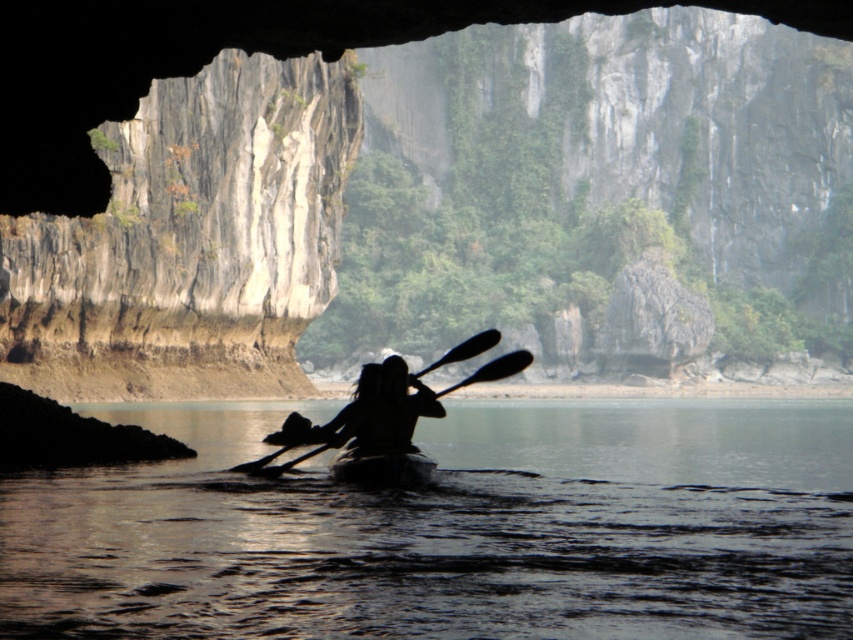
Based on the photo, can you confirm if transparent water at center is taller than black matte paddle at center?

In fact, transparent water at center may be shorter than black matte paddle at center.

Is point (62, 548) positioned behind point (310, 451)?

That is False.

Locate an element on the screen. This screenshot has height=640, width=853. transparent water at center is located at coordinates (451, 529).

Who is more forward, (x=54, y=624) or (x=396, y=406)?

Point (x=54, y=624)

Between transparent water at center and silhouette wood paddle at center, which one has less height?

transparent water at center

Is point (126, 513) behind point (424, 406)?

No, (126, 513) is in front of (424, 406).

Where is `transparent water at center`? The height and width of the screenshot is (640, 853). transparent water at center is located at coordinates (451, 529).

Is point (383, 467) positioned after point (250, 468)?

That is False.

Locate an element on the screen. The image size is (853, 640). smooth dark gray canoe at center is located at coordinates (383, 467).

Find the location of a particular element. This screenshot has height=640, width=853. smooth dark gray canoe at center is located at coordinates (383, 467).